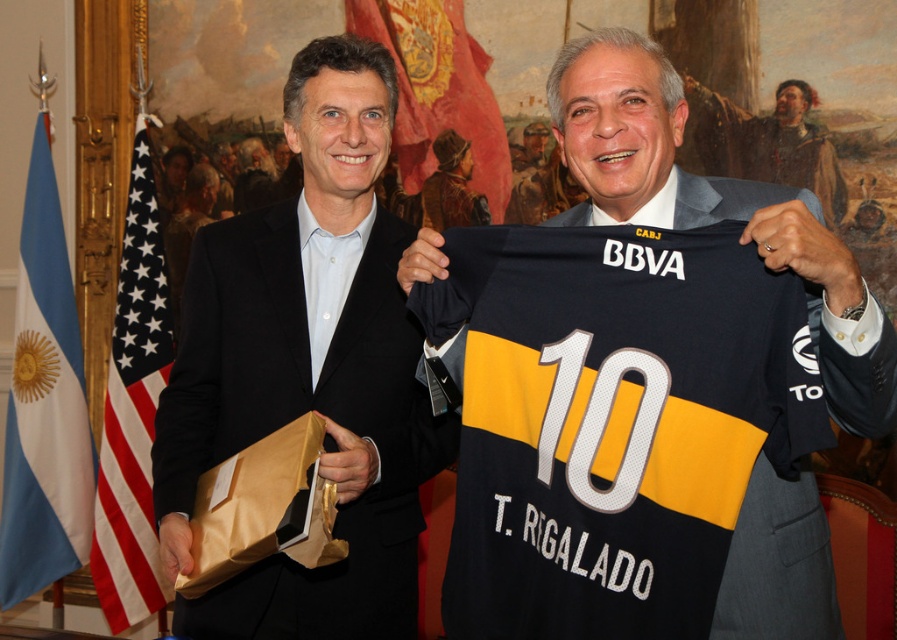
Does matte black suit at left appear on the left side of brown leather jacket at upper center?

Correct, you'll find matte black suit at left to the left of brown leather jacket at upper center.

Which of these two, matte black suit at left or brown leather jacket at upper center, stands taller?

With more height is matte black suit at left.

Which is in front, point (410, 320) or point (732, 132)?

Point (410, 320) is more forward.

Locate an element on the screen. matte black suit at left is located at coordinates (308, 369).

Is point (379, 321) in front of point (453, 372)?

No.

Which is more to the right, matte black suit at left or black jersey at center?

Positioned to the right is black jersey at center.

Is point (353, 522) in front of point (830, 337)?

No, (353, 522) is behind (830, 337).

Locate an element on the screen. Image resolution: width=897 pixels, height=640 pixels. matte black suit at left is located at coordinates (308, 369).

Does point (708, 138) come behind point (344, 252)?

Yes, point (708, 138) is behind point (344, 252).

Is point (774, 164) in front of point (310, 289)?

No, it is not.

Find the location of a particular element. The image size is (897, 640). brown leather jacket at upper center is located at coordinates 768,144.